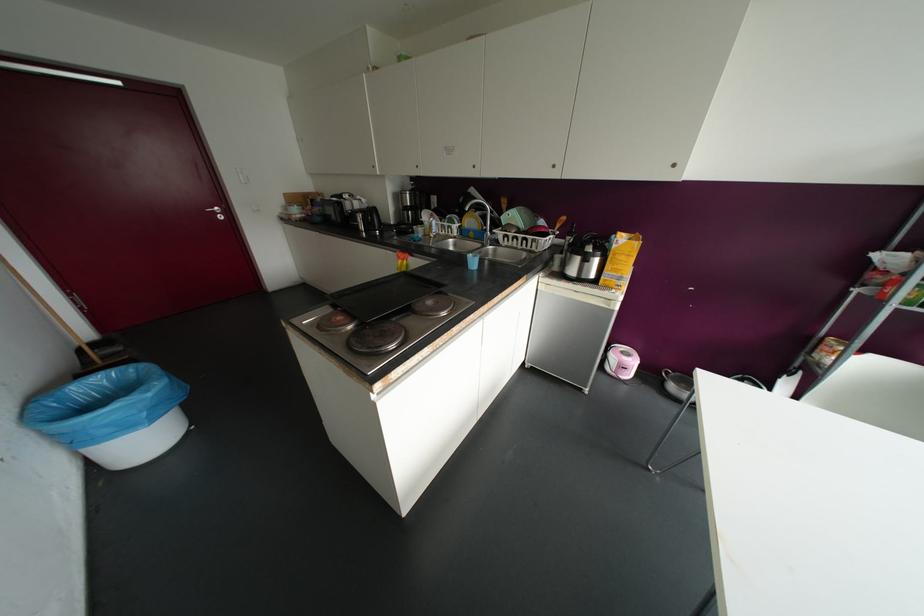
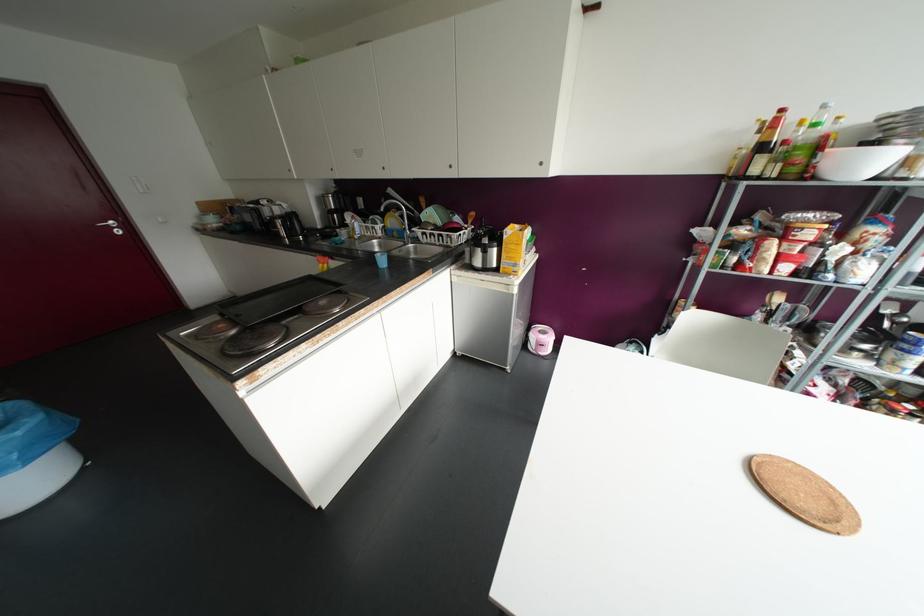
Find the pixel in the second image that matches pixel 499 233 in the first image.

(417, 231)